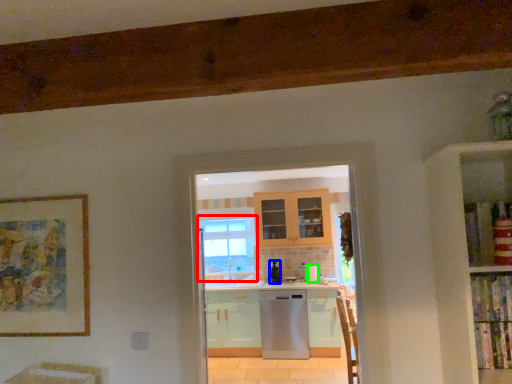
Question: Based on their relative distances, which object is farther from window (highlighted by a red box)? Choose from kitchen appliance (highlighted by a blue box) and appliance (highlighted by a green box).

Choices:
 (A) kitchen appliance
 (B) appliance

Answer: (B)